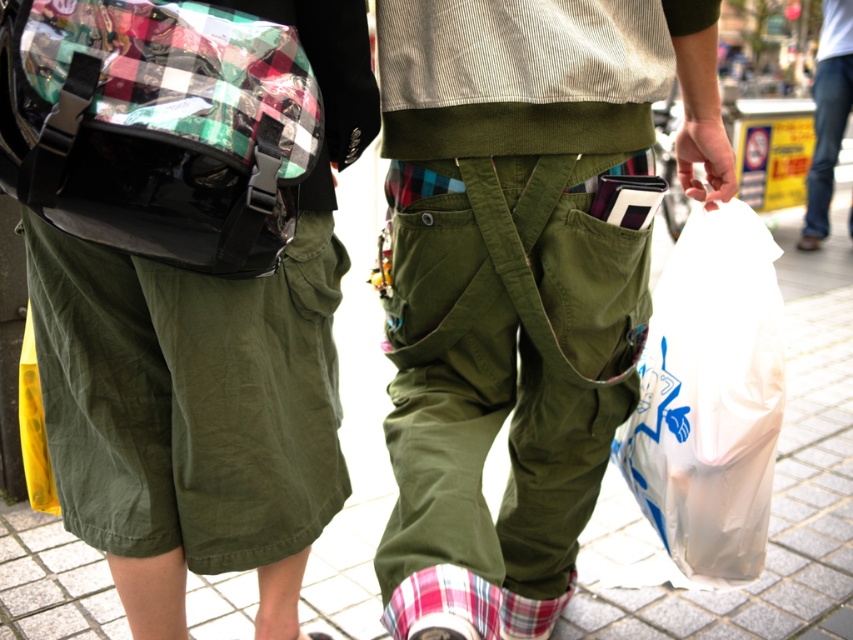
Can you confirm if plaid fabric bag at left is thinner than olive green canvas pocket at center?

Yes, plaid fabric bag at left is thinner than olive green canvas pocket at center.

From the picture: Is plaid fabric bag at left taller than olive green canvas pocket at center?

No.

Does point (202, 257) lie in front of point (438, 346)?

That is True.

The image size is (853, 640). Identify the location of plaid fabric bag at left. (158, 128).

Between olive green pants at center and plaid fabric bag at left, which one is positioned lower?

Positioned lower is olive green pants at center.

At what (x,y) coordinates should I click in order to perform the action: click on olive green pants at center. Please return your answer as a coordinate pair (x, y). The width and height of the screenshot is (853, 640). Looking at the image, I should click on (517, 282).

Does olive green pants at center have a lesser height compared to olive green canvas pocket at center?

In fact, olive green pants at center may be taller than olive green canvas pocket at center.

Can you confirm if olive green pants at center is positioned to the right of olive green canvas pocket at center?

Incorrect, olive green pants at center is not on the right side of olive green canvas pocket at center.

Between point (607, 164) and point (563, 358), which one is positioned in front?

Positioned in front is point (607, 164).

The width and height of the screenshot is (853, 640). I want to click on olive green pants at center, so click(517, 282).